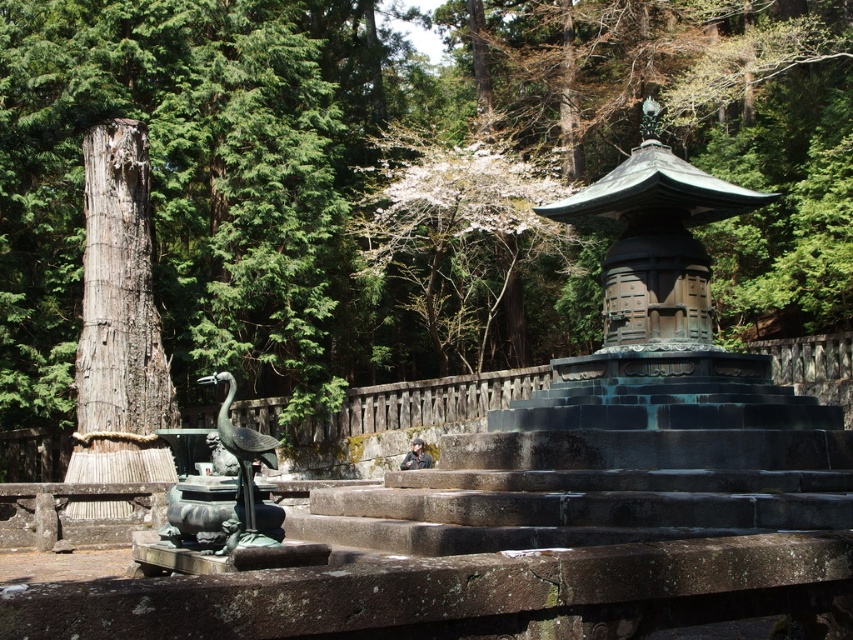
You are a gardener planning to place a new decorative stone between the white blossoms at upper center and the bronze statue at center. Based on their widths, which object should the stone be placed closer to?

The white blossoms at upper center might be wider than bronze statue at center, so the stone should be placed closer to the bronze statue at center to ensure it fits within the available space.

You are a photographer aiming to capture the white blossoms at upper center in the image. Based on their 2D coordinates, which direction should you move your camera to center them in your viewfinder?

The white blossoms at upper center are located at coordinates 0.359 on the x axis and 0.535 on the y axis. To center them in the viewfinder, you should move the camera slightly to the left and downward since the blossoms are positioned to the left and below the center point of the image.

You are standing in a traditional Japanese garden and see a multi tiered stone lantern with dark green sloped roof atop stone steps and a crane statue on a pedestal to its left. There is a point at coordinates (x=119, y=321). What object is located at that point?

The point at coordinates (x=119, y=321) corresponds to the weathered wood pillar at left.